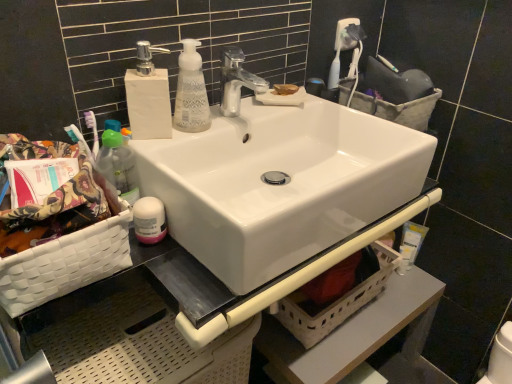
Question: From a real-world perspective, is beige woven basket at lower center, acting as the 2th basket starting from the left, positioned above or below white matte soap dispenser at upper left?

Choices:
 (A) below
 (B) above

Answer: (A)

Question: In the image, is beige woven basket at lower center, marked as the 2th basket in a back-to-front arrangement, positioned in front of or behind white matte soap dispenser at upper left?

Choices:
 (A) behind
 (B) front

Answer: (A)

Question: Estimate the real-world distances between objects in this image. Which object is closer to the translucent plastic bottle at left?

Choices:
 (A) white glossy sink at center
 (B) beige woven basket at lower center, the second basket in the right-to-left sequence
 (C) white glossy faucet at upper center
 (D) beige fabric basket at upper right, which is the third basket in front-to-back order
 (E) clear glass soap dispenser at upper center

Answer: (E)

Question: Which object is the closest to the white matte soap dispenser at upper left?

Choices:
 (A) white woven basket at lower left, which ranks as the second basket in top-to-bottom order
 (B) translucent plastic bottle at left
 (C) beige woven basket at lower center, acting as the 2th basket starting from the left
 (D) white glossy faucet at upper center
 (E) pink glossy lotion at lower left, which is the 1th toiletry from front to back

Answer: (B)